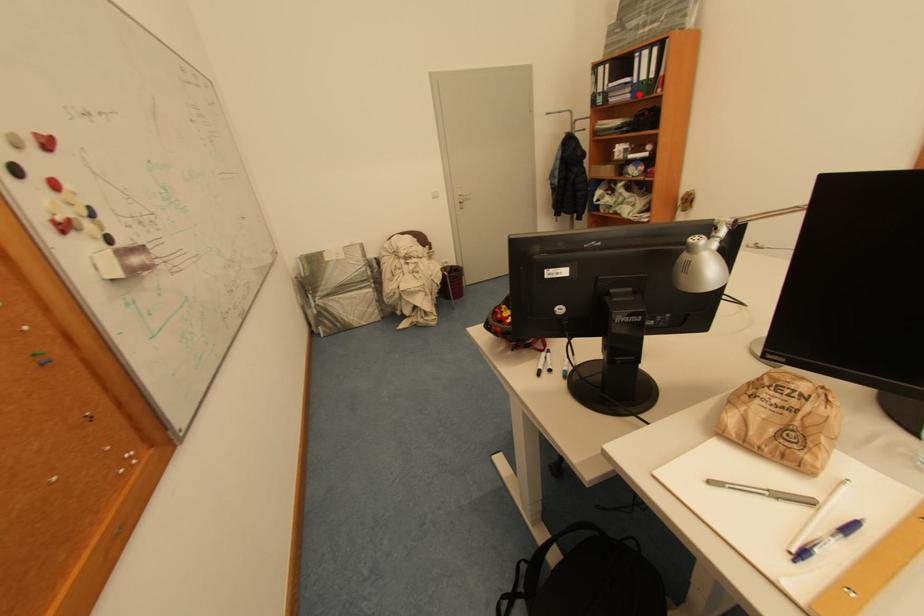
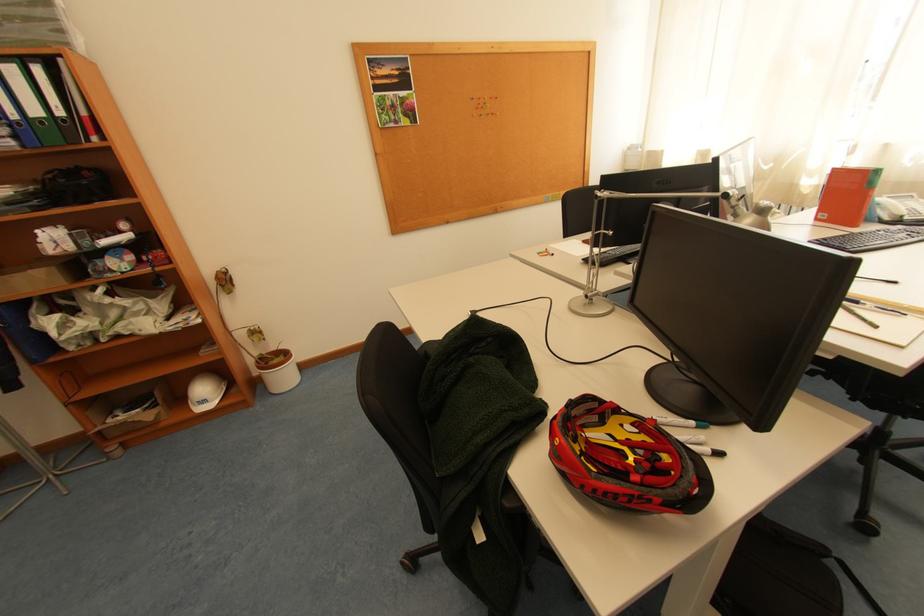
Where in the second image is the point corresponding to the highlighted location from the first image?

(23, 139)